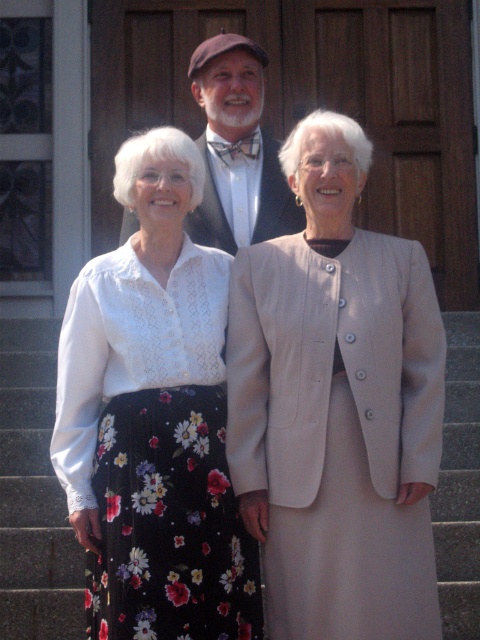
Based on the photo, you are standing in front of the wooden door with a glass panel on the left. There is a point marked at coordinates [336,406]. What object is located at this point?

The point at [336,406] marks the beige fabric skirt at center.